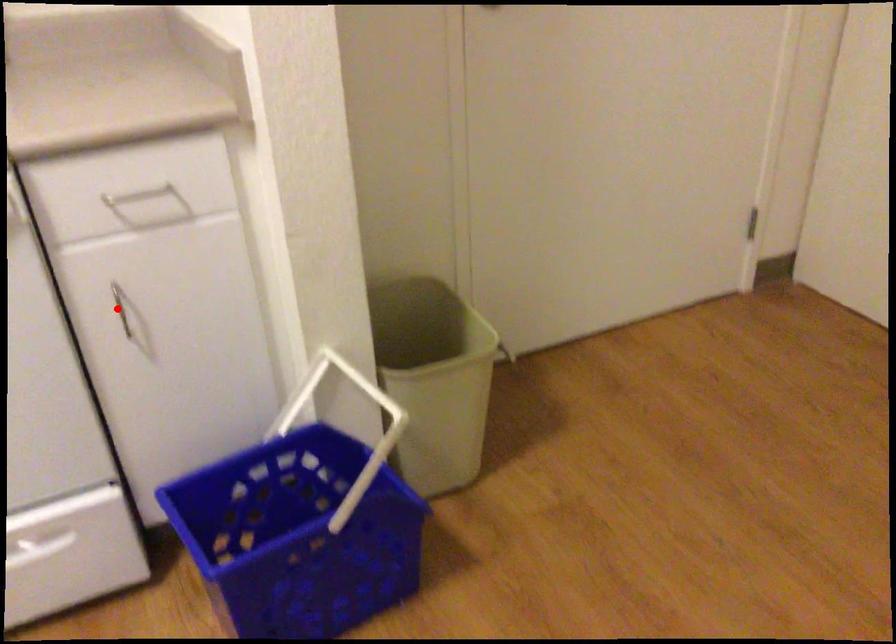
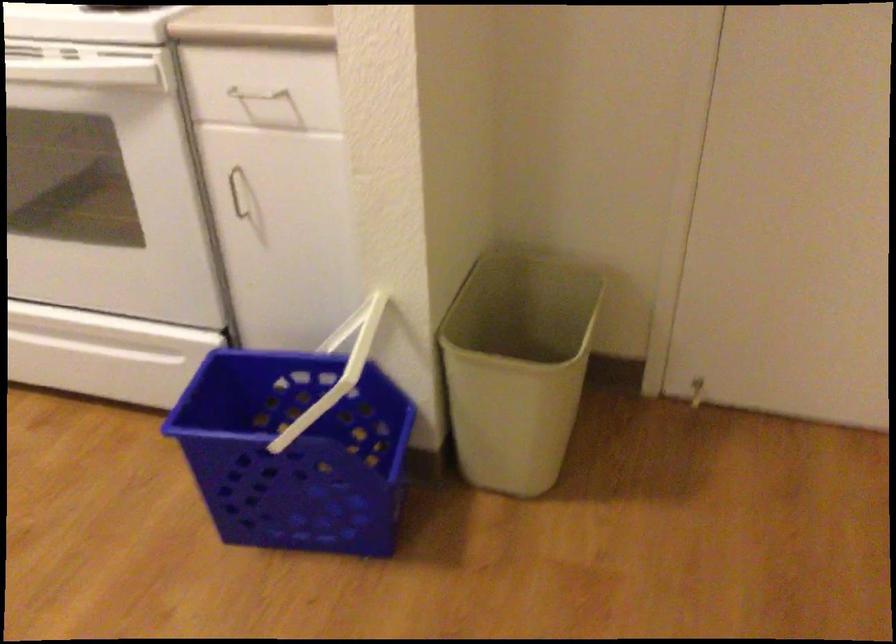
Question: I am providing you with two images of the same scene from different viewpoints. Image1 has a red point marked. In image2, the corresponding 3D location appears at what relative position? Reply with the corresponding letter.

Choices:
 (A) Closer
 (B) Farther

Answer: (B)